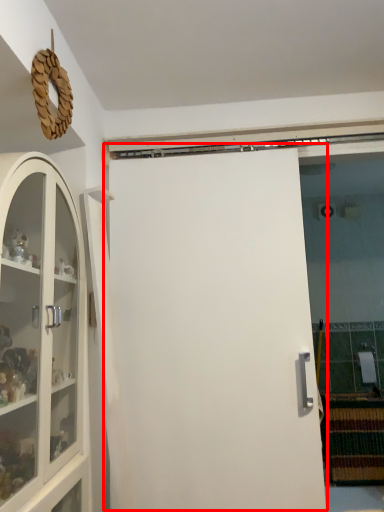
Question: From the image's perspective, what is the correct spatial positioning of door (annotated by the red box) in reference to cabinetry?

Choices:
 (A) below
 (B) above

Answer: (A)